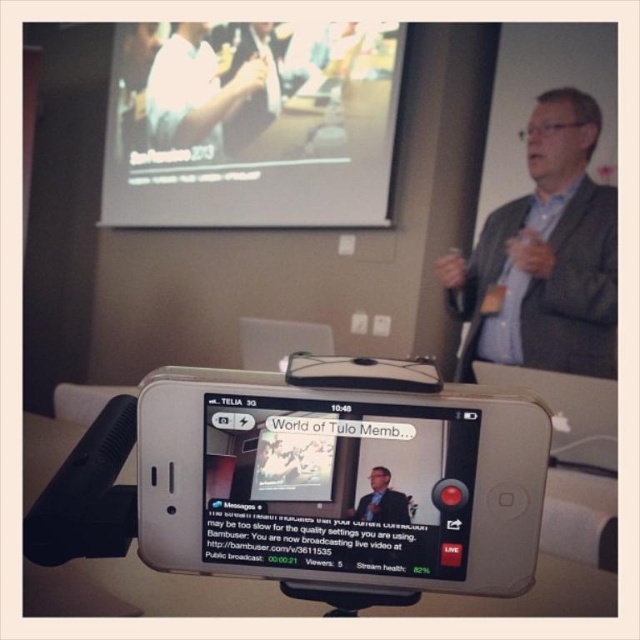
This screenshot has height=640, width=640. Find the location of `silver metallic phone at center`. silver metallic phone at center is located at coordinates (307, 481).

Does gray textured blazer at upper right come behind white matte shirt at upper left?

No.

Can you confirm if gray textured blazer at upper right is taller than white matte shirt at upper left?

Yes, gray textured blazer at upper right is taller than white matte shirt at upper left.

Who is more forward, (616,310) or (177,138)?

Point (616,310) is in front.

Find the location of a particular element. Image resolution: width=640 pixels, height=640 pixels. gray textured blazer at upper right is located at coordinates (545, 256).

Can you confirm if matte white projector screen at upper center is positioned to the left of matte black suit at center?

Indeed, matte white projector screen at upper center is positioned on the left side of matte black suit at center.

In the scene shown: Does matte white projector screen at upper center appear under matte black suit at center?

No.

This screenshot has height=640, width=640. What are the coordinates of `matte white projector screen at upper center` in the screenshot? It's located at (252, 124).